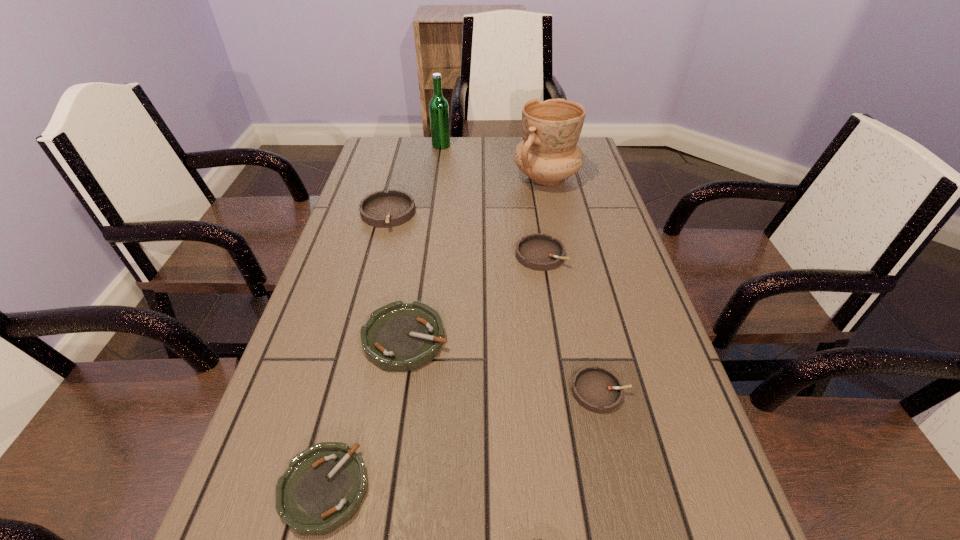
The image size is (960, 540). Find the location of `vacant space that satisfies the following two spatial constraints: 1. on the front side of the fifth nearest object; 2. on the left side of the smaller green ashtray`. vacant space that satisfies the following two spatial constraints: 1. on the front side of the fifth nearest object; 2. on the left side of the smaller green ashtray is located at coordinates (315, 489).

I want to click on vacant space that satisfies the following two spatial constraints: 1. on the back side of the farther green ashtray; 2. on the right side of the green beer bottle, so click(x=436, y=146).

Where is `vacant space that satisfies the following two spatial constraints: 1. on the back side of the nearest gray ashtray; 2. on the left side of the smaller green ashtray`? This screenshot has height=540, width=960. vacant space that satisfies the following two spatial constraints: 1. on the back side of the nearest gray ashtray; 2. on the left side of the smaller green ashtray is located at coordinates (348, 391).